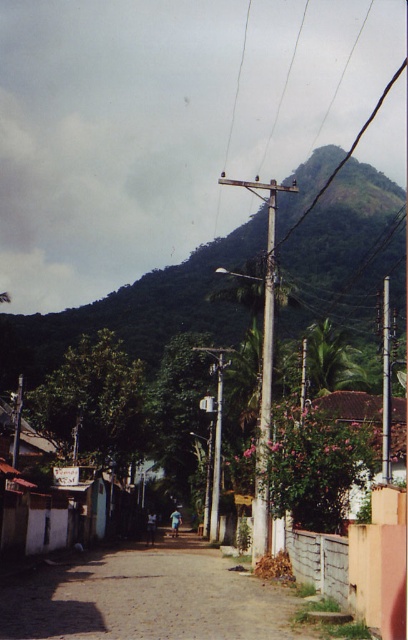
You are a delivery person trying to navigate through the narrowest part of the brown cobblestone alley at center. You have a cart that is as wide as the brown wooden pole at upper center. Will your cart fit through the alley?

The brown cobblestone alley at center is thinner than the brown wooden pole at upper center. Since the cart is as wide as the pole, the alley is narrower than the cart, so the cart will not fit through the alley.

Consider the image. You are a tourist standing on the cobblestone path in the rural street scene. You notice the brown cobblestone alley at center and the brown wooden pole at upper center. Which object is positioned higher in the image?

The brown wooden pole at upper center is positioned higher in the image than the brown cobblestone alley at center.